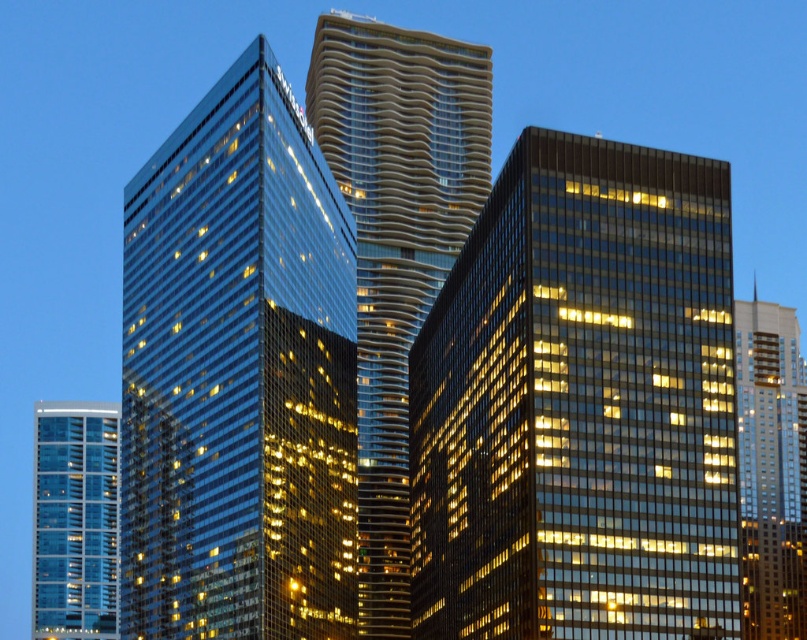
Question: Is glossy glass building at center positioned at the back of transparent glass building at lower left?

Choices:
 (A) yes
 (B) no

Answer: (B)

Question: Which of the following is the farthest from the observer?

Choices:
 (A) matte glass skyscraper at center
 (B) glossy glass skyscraper at center
 (C) transparent glass building at lower left

Answer: (C)

Question: Is glassy reflective tower at center smaller than transparent glass building at lower left?

Choices:
 (A) no
 (B) yes

Answer: (A)

Question: Estimate the real-world distances between objects in this image. Which object is closer to the glassy reflective tower at center?

Choices:
 (A) transparent glass building at lower left
 (B) glossy glass building at center
 (C) matte glass skyscraper at center
 (D) glossy glass skyscraper at center

Answer: (D)

Question: Is glossy glass skyscraper at center to the left of glassy reflective tower at center from the viewer's perspective?

Choices:
 (A) no
 (B) yes

Answer: (B)

Question: Which object appears farthest from the camera in this image?

Choices:
 (A) glossy glass skyscraper at center
 (B) transparent glass building at lower left
 (C) matte glass skyscraper at center
 (D) glossy glass building at center

Answer: (B)